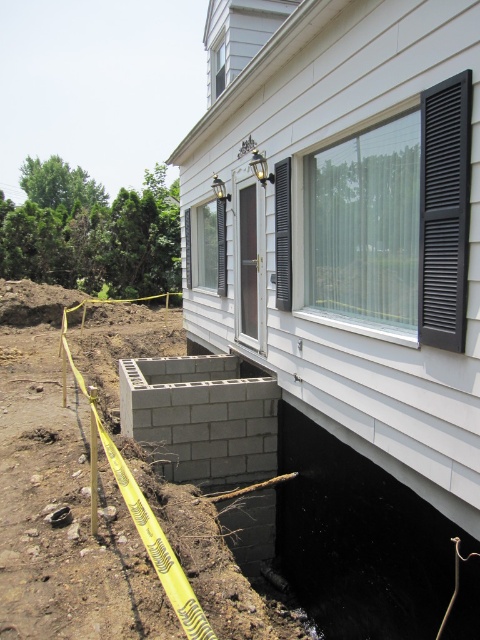
Does white siding at center come in front of dirt/soil at lower left?

Yes, it is in front of dirt/soil at lower left.

Identify the location of white siding at center. The width and height of the screenshot is (480, 640). (347, 224).

I want to click on white siding at center, so click(x=347, y=224).

Which is more to the left, gray concrete block at lower center or dirt/soil at lower left?

From the viewer's perspective, dirt/soil at lower left appears more on the left side.

Which is behind, point (172, 432) or point (43, 433)?

The point (43, 433) is more distant.

Does point (216, 445) come farther from viewer compared to point (36, 428)?

No, (216, 445) is in front of (36, 428).

Where is `gray concrete block at lower center`? The image size is (480, 640). gray concrete block at lower center is located at coordinates 201,417.

What do you see at coordinates (347, 224) in the screenshot? I see `white siding at center` at bounding box center [347, 224].

Measure the distance between point (204, 212) and camera.

Point (204, 212) and camera are 10.21 meters apart from each other.

The image size is (480, 640). Describe the element at coordinates (347, 224) in the screenshot. I see `white siding at center` at that location.

This screenshot has width=480, height=640. What are the coordinates of `white siding at center` in the screenshot? It's located at (347, 224).